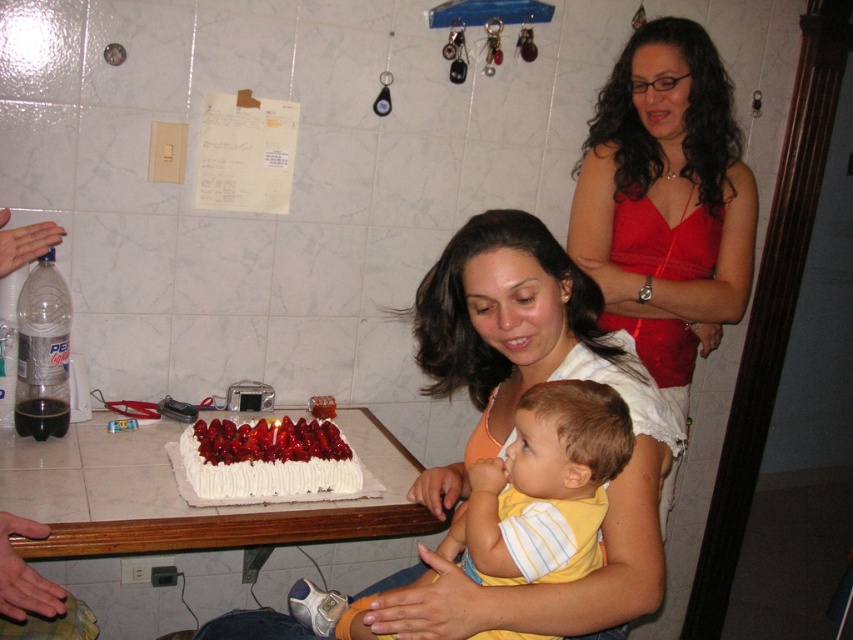
Question: Among these objects, which one is farthest from the camera?

Choices:
 (A) white cream cake with strawberries at center
 (B) matte red dress at upper right
 (C) white wood table at lower left

Answer: (B)

Question: Which of the following is the farthest from the observer?

Choices:
 (A) (577, 563)
 (B) (289, 445)
 (C) (674, 362)
 (D) (160, 451)

Answer: (C)

Question: Can you confirm if white wood table at lower left is bigger than white cream cake with strawberries at center?

Choices:
 (A) yes
 (B) no

Answer: (A)

Question: Considering the relative positions of white wood table at lower left and yellow striped shirt at center in the image provided, where is white wood table at lower left located with respect to yellow striped shirt at center?

Choices:
 (A) above
 (B) below

Answer: (A)

Question: Is white wood table at lower left behind yellow striped shirt at center?

Choices:
 (A) no
 (B) yes

Answer: (B)

Question: Which of the following is the farthest from the observer?

Choices:
 (A) (556, 515)
 (B) (576, 252)
 (C) (200, 451)
 (D) (163, 506)

Answer: (B)